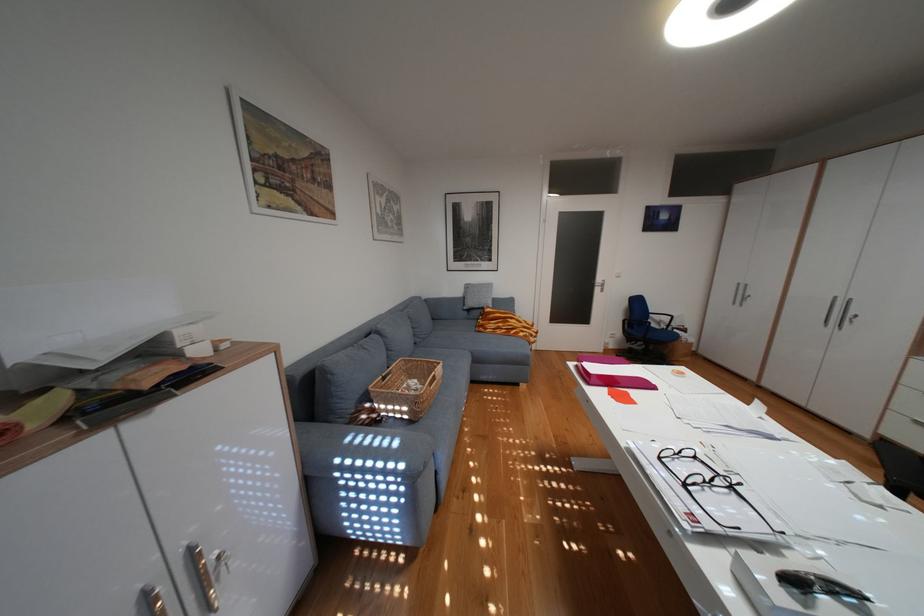
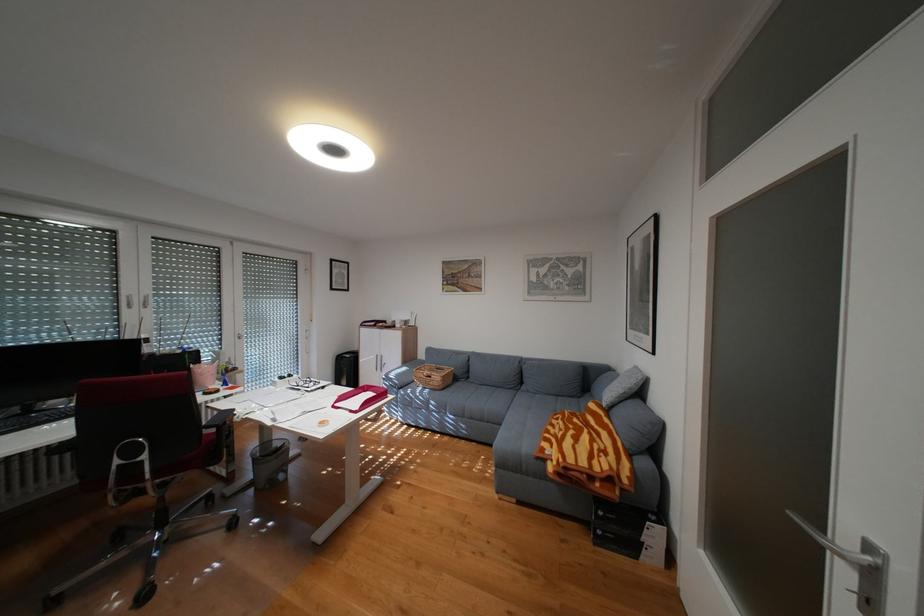
Locate, in the second image, the point that corresponds to point (535, 331) in the first image.

(564, 445)